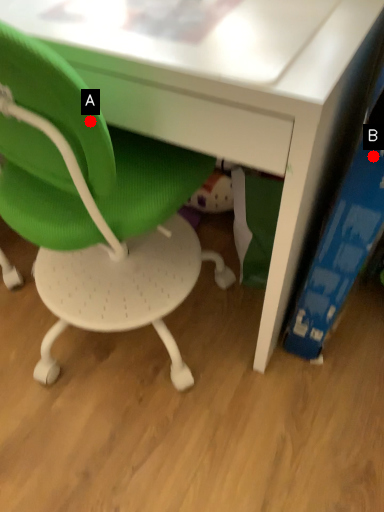
Question: Two points are circled on the image, labeled by A and B beside each circle. Among these points, which one is farthest from the camera?

Choices:
 (A) A is further
 (B) B is further

Answer: (B)